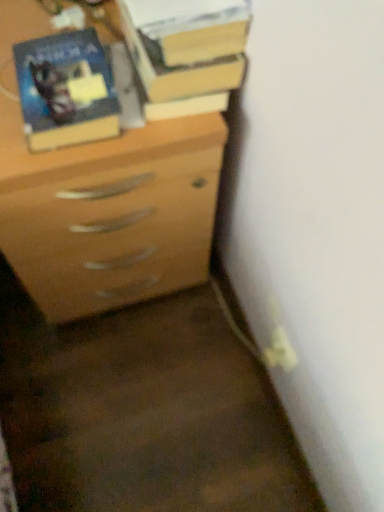
Question: Is hardcover book at upper center at the back of matte wood chest of drawers at center?

Choices:
 (A) yes
 (B) no

Answer: (B)

Question: Is matte wood chest of drawers at center shorter than hardcover book at upper center?

Choices:
 (A) no
 (B) yes

Answer: (A)

Question: Is hardcover book at upper center completely or partially inside matte wood chest of drawers at center?

Choices:
 (A) yes
 (B) no

Answer: (B)

Question: From the image's perspective, does matte wood chest of drawers at center appear higher than hardcover book at upper center?

Choices:
 (A) yes
 (B) no

Answer: (B)

Question: Can you confirm if matte wood chest of drawers at center is bigger than hardcover book at upper center?

Choices:
 (A) no
 (B) yes

Answer: (B)

Question: In terms of width, does matte black book at upper left look wider or thinner when compared to matte wood chest of drawers at center?

Choices:
 (A) wide
 (B) thin

Answer: (B)

Question: Considering the positions of matte black book at upper left and matte wood chest of drawers at center in the image, is matte black book at upper left taller or shorter than matte wood chest of drawers at center?

Choices:
 (A) tall
 (B) short

Answer: (B)

Question: From the image's perspective, relative to matte wood chest of drawers at center, is matte black book at upper left above or below?

Choices:
 (A) below
 (B) above

Answer: (B)

Question: From a real-world perspective, is matte black book at upper left above or below matte wood chest of drawers at center?

Choices:
 (A) below
 (B) above

Answer: (B)

Question: Considering the positions of matte black book at upper left and hardcover book at upper center in the image, is matte black book at upper left taller or shorter than hardcover book at upper center?

Choices:
 (A) tall
 (B) short

Answer: (A)

Question: Is point (102, 97) closer or farther from the camera than point (173, 2)?

Choices:
 (A) closer
 (B) farther

Answer: (B)

Question: Visually, is matte black book at upper left positioned to the left or to the right of hardcover book at upper center?

Choices:
 (A) right
 (B) left

Answer: (B)

Question: Is matte black book at upper left in front of or behind hardcover book at upper center in the image?

Choices:
 (A) front
 (B) behind

Answer: (A)

Question: In terms of width, does matte wood chest of drawers at center look wider or thinner when compared to matte black book at upper left?

Choices:
 (A) thin
 (B) wide

Answer: (B)

Question: From a real-world perspective, is matte wood chest of drawers at center positioned above or below matte black book at upper left?

Choices:
 (A) above
 (B) below

Answer: (B)